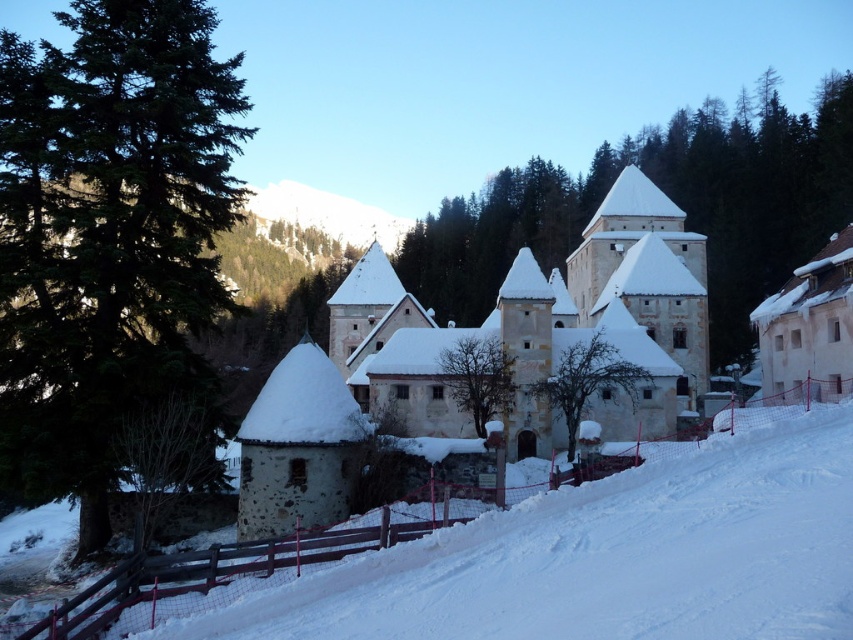
Who is more distant from viewer, (500, 580) or (595, 385)?

The point (595, 385) is behind.

Who is shorter, white snow at lower right or snowy bare tree at center?

Standing shorter between the two is white snow at lower right.

Where is `white snow at lower right`? The width and height of the screenshot is (853, 640). white snow at lower right is located at coordinates (606, 557).

Which is in front, point (173, 52) or point (489, 248)?

Point (173, 52) is more forward.

Which is behind, point (163, 76) or point (701, 188)?

The point (701, 188) is more distant.

What are the coordinates of `green coniferous tree at left` in the screenshot? It's located at [107, 234].

Looking at this image, between white snow at lower right and bare branches at center, which one appears on the right side from the viewer's perspective?

From the viewer's perspective, white snow at lower right appears more on the right side.

Is point (426, 568) positioned behind point (508, 394)?

No.

I want to click on white snow at lower right, so click(606, 557).